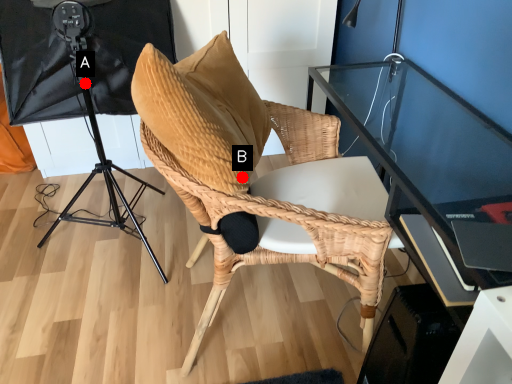
Question: Two points are circled on the image, labeled by A and B beside each circle. Which point is farther from the camera taking this photo?

Choices:
 (A) A is further
 (B) B is further

Answer: (A)